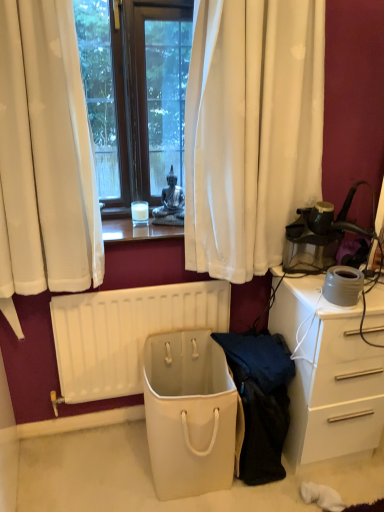
Question: Should I look upward or downward to see dark blue fabric at center?

Choices:
 (A) down
 (B) up

Answer: (A)

Question: Can you confirm if dark blue fabric at center is bigger than white glossy desk at right?

Choices:
 (A) no
 (B) yes

Answer: (A)

Question: Can you confirm if dark blue fabric at center is positioned to the left of white glossy desk at right?

Choices:
 (A) yes
 (B) no

Answer: (A)

Question: Is dark blue fabric at center not within white glossy desk at right?

Choices:
 (A) yes
 (B) no

Answer: (A)

Question: Considering the relative sizes of dark blue fabric at center and white glossy desk at right in the image provided, is dark blue fabric at center wider than white glossy desk at right?

Choices:
 (A) yes
 (B) no

Answer: (B)

Question: Considering the relative sizes of dark blue fabric at center and white glossy desk at right in the image provided, is dark blue fabric at center thinner than white glossy desk at right?

Choices:
 (A) yes
 (B) no

Answer: (A)

Question: Is dark blue fabric at center taller than white glossy desk at right?

Choices:
 (A) yes
 (B) no

Answer: (B)

Question: Is dark blue fabric at center surrounded by white glossy desk at right?

Choices:
 (A) no
 (B) yes

Answer: (A)

Question: Is white glossy desk at right looking in the opposite direction of dark blue fabric at center?

Choices:
 (A) yes
 (B) no

Answer: (B)

Question: From the image's perspective, does white glossy desk at right appear higher than dark blue fabric at center?

Choices:
 (A) yes
 (B) no

Answer: (A)

Question: Does white glossy desk at right have a smaller size compared to dark blue fabric at center?

Choices:
 (A) no
 (B) yes

Answer: (A)

Question: Can you confirm if white glossy desk at right is positioned to the right of dark blue fabric at center?

Choices:
 (A) no
 (B) yes

Answer: (B)

Question: Would you say white glossy desk at right is a long distance from dark blue fabric at center?

Choices:
 (A) no
 (B) yes

Answer: (A)

Question: Is beige fabric bag at center at the back of white glossy desk at right?

Choices:
 (A) no
 (B) yes

Answer: (A)